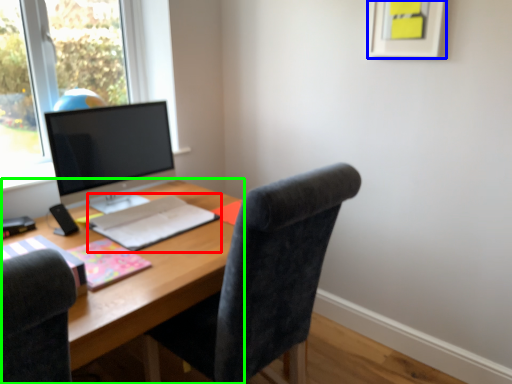
Question: Considering the real-world distances, which object is closest to notebook (highlighted by a red box)? picture frame (highlighted by a blue box) or desk (highlighted by a green box).

Choices:
 (A) picture frame
 (B) desk

Answer: (B)